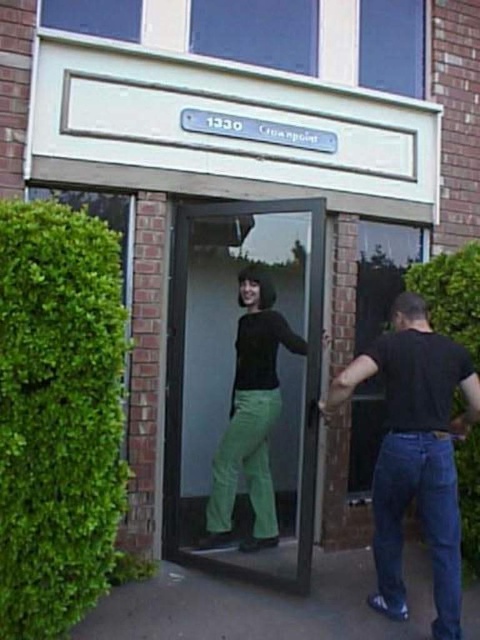
Can you confirm if transparent glass door at center is positioned to the right of black cotton shirt at right?

Incorrect, transparent glass door at center is not on the right side of black cotton shirt at right.

Consider the image. Can you confirm if transparent glass door at center is wider than black cotton shirt at right?

Yes.

Describe the element at coordinates (243, 387) in the screenshot. Image resolution: width=480 pixels, height=640 pixels. I see `transparent glass door at center` at that location.

Find the location of a particular element. This screenshot has height=640, width=480. transparent glass door at center is located at coordinates (243, 387).

Does black cotton shirt at right have a smaller size compared to matte black shirt at center?

Yes.

Who is positioned more to the left, black cotton shirt at right or matte black shirt at center?

Positioned to the left is matte black shirt at center.

Between point (443, 621) and point (223, 449), which one is positioned in front?

Point (443, 621)

The height and width of the screenshot is (640, 480). I want to click on black cotton shirt at right, so click(416, 452).

Looking at this image, can you confirm if transparent glass door at center is wider than matte black shirt at center?

Correct, the width of transparent glass door at center exceeds that of matte black shirt at center.

Who is positioned more to the right, transparent glass door at center or matte black shirt at center?

matte black shirt at center is more to the right.

Which is behind, point (299, 326) or point (287, 348)?

The point (299, 326) is behind.

The width and height of the screenshot is (480, 640). Identify the location of transparent glass door at center. tap(243, 387).